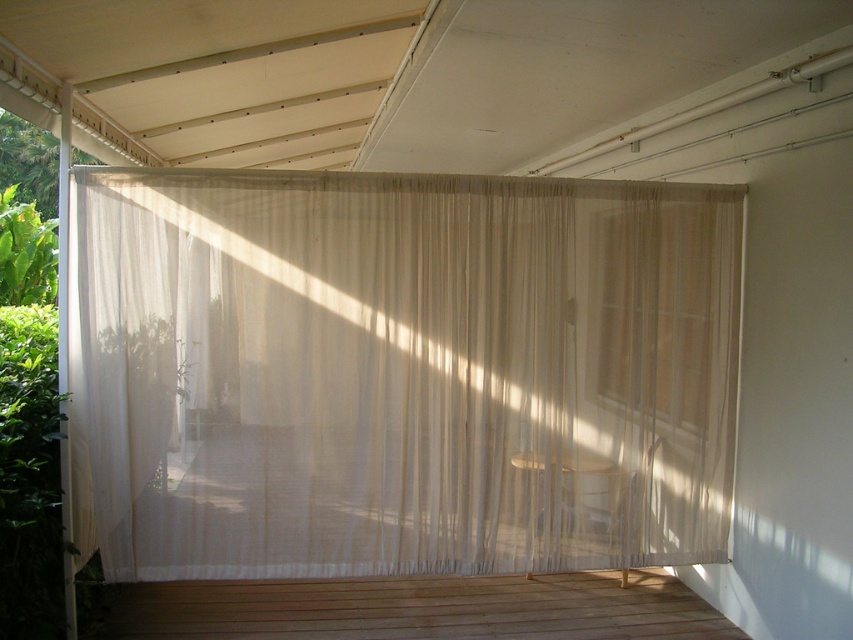
You are standing on the wooden deck at lower center represented by point (418,609). You want to walk towards the greenery on the left side of the image. Which direction should you move relative to the wooden deck at lower center?

Since the greenery is on the left side of the image, you should move towards the left direction from the wooden deck at lower center represented by point (418,609).

You are standing at the center of the patio and want to walk towards the point that is closer to the camera. Which point should you head towards, point (273,580) or point (666,308)?

You should head towards point (666,308) because it is closer to the camera compared to point (273,580).